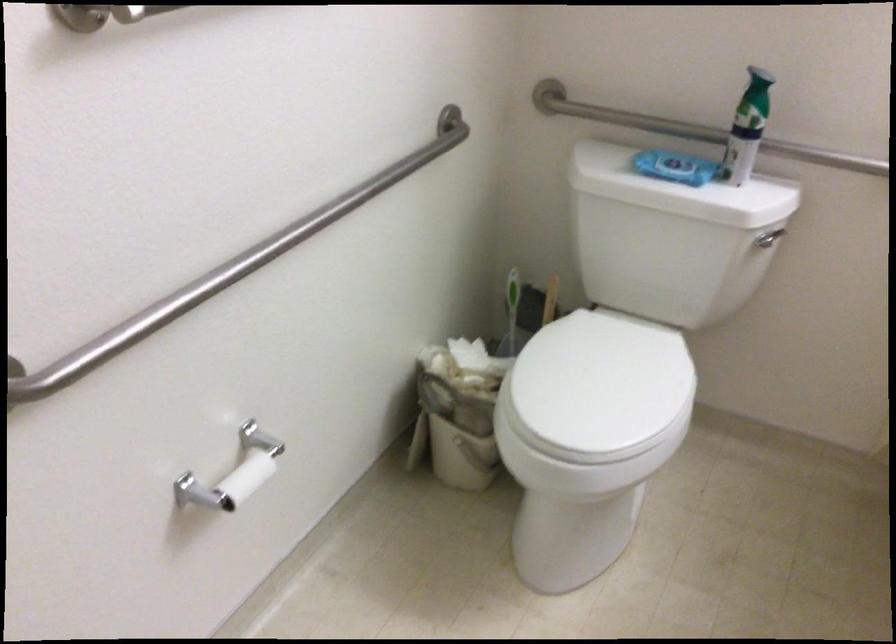
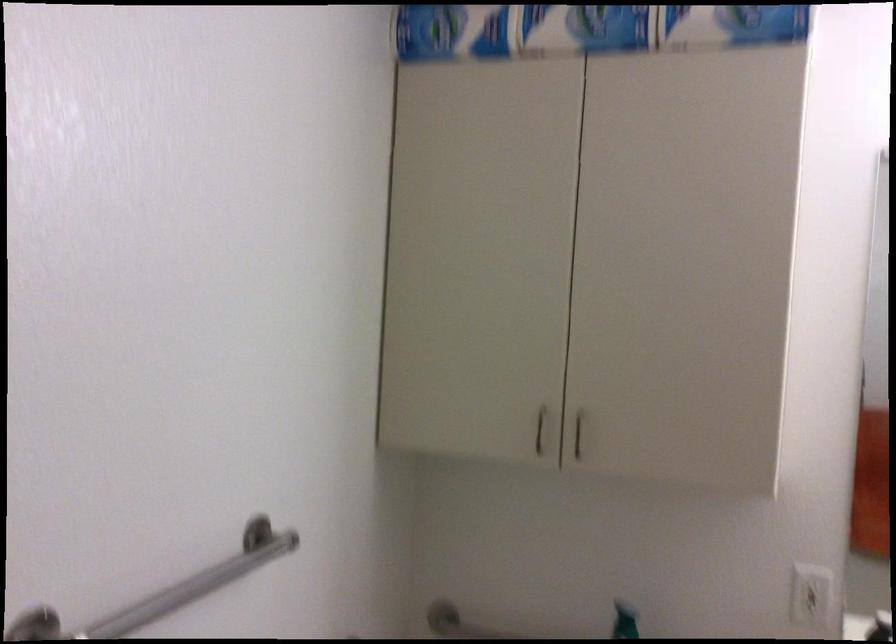
Question: The images are taken continuously from a first-person perspective. In which direction is your viewpoint rotating?

Choices:
 (A) Left
 (B) Right
 (C) Up
 (D) Down

Answer: (C)